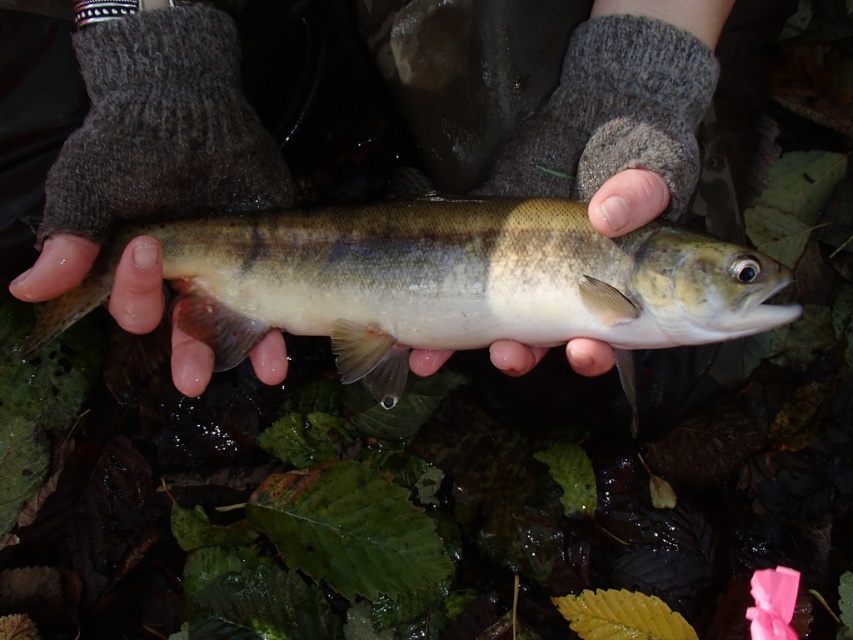
In the scene shown: Does shiny silver fish at center lie in front of smooth skin hand at center?

No, shiny silver fish at center is behind smooth skin hand at center.

Which is behind, point (259, 333) or point (610, 198)?

Point (259, 333)

Is point (408, 272) closer to viewer compared to point (590, 195)?

Yes, point (408, 272) is in front of point (590, 195).

Find the location of a particular element. The image size is (853, 640). shiny silver fish at center is located at coordinates (440, 282).